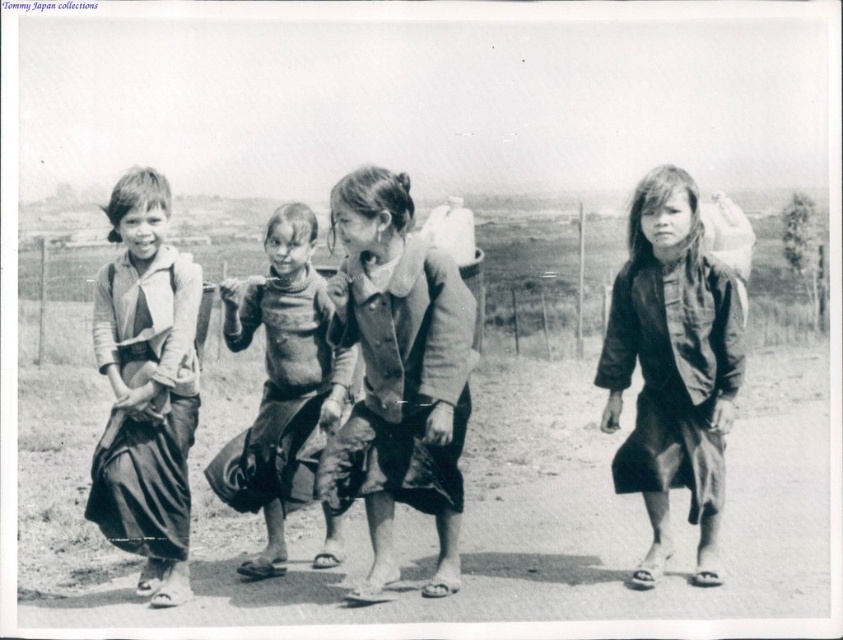
You are standing at the center of the image and want to walk to the dirt field at lower left. Which direction should you face to head directly towards it?

You should face towards the lower left direction to head directly towards the dirt field at lower left since it is located at point (466, 512) which is in the lower left area of the image.

You are a photographer analyzing this black and white photo of four children. You notice two points marked at coordinates point (395, 442) and point (149, 532). Which point is closer to the camera?

Point (395, 442) is further to the viewer than point (149, 532). Therefore, point (149, 532) is closer to the camera.